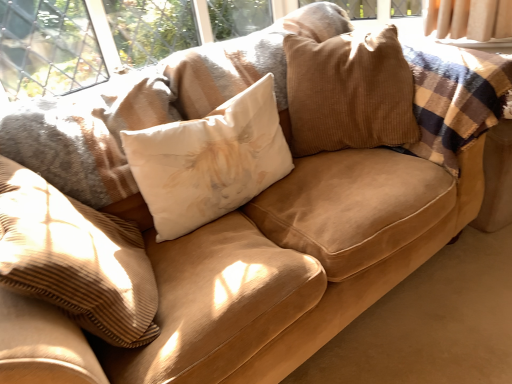
Question: From the image's perspective, is corduroy pillow at center, which ranks as the first pillow in right-to-left order, located above or below white cotton pillow at center, which is counted as the second pillow, starting from the left?

Choices:
 (A) below
 (B) above

Answer: (B)

Question: Based on their sizes in the image, would you say corduroy pillow at center, which ranks as the first pillow in right-to-left order, is bigger or smaller than white cotton pillow at center, which is counted as the second pillow, starting from the left?

Choices:
 (A) small
 (B) big

Answer: (B)

Question: Which object is the farthest from the corduroy pillow at center, which ranks as the first pillow in right-to-left order?

Choices:
 (A) white cotton pillow at center, positioned as the second pillow in right-to-left order
 (B) white corduroy pillow at center, the 1th pillow in the left-to-right sequence

Answer: (B)

Question: Which is farther from the corduroy pillow at center, which is the 3th pillow in left-to-right order?

Choices:
 (A) white cotton pillow at center, which is counted as the second pillow, starting from the left
 (B) white corduroy pillow at center, the 1th pillow in the left-to-right sequence

Answer: (B)